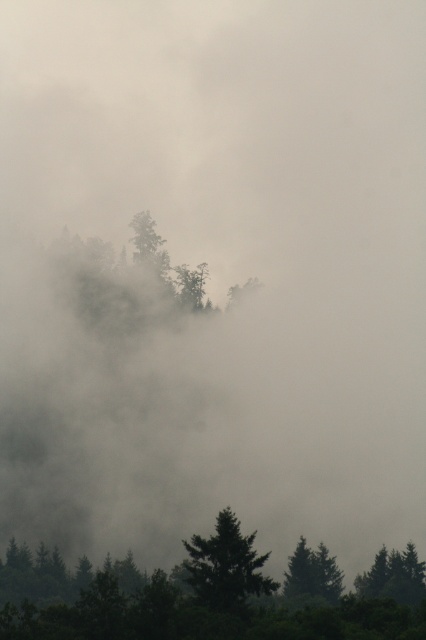
You are standing in the misty forest scene. There are two points marked in the image. The first point is at coordinate point (118, 600), and the second is at point (221, 534). Which point is closer to you?

Point (118, 600) is closer to the viewer than point (221, 534).

From the picture: You are standing in the misty forest scene. There is a point marked at coordinates (213, 596). What object is located at that point?

The point at coordinates (213, 596) marks green matte trees at lower center.

You are an observer in the misty forest scene. You see two green matte trees at lower center and a green matte tree at lower center. Which one is positioned to the right?

The green matte trees at lower center is positioned to the right of the green matte tree at lower center.